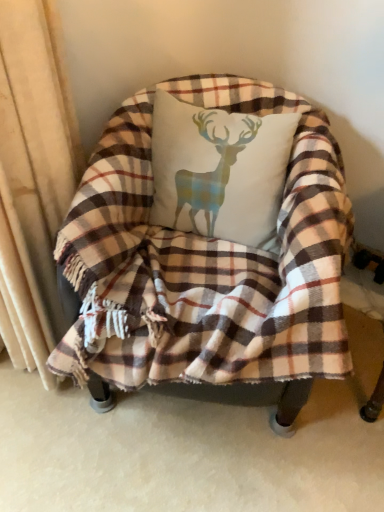
Question: Considering the positions of point (231, 200) and point (130, 360), is point (231, 200) closer or farther from the camera than point (130, 360)?

Choices:
 (A) closer
 (B) farther

Answer: (B)

Question: In the image, is white cotton cushion with deer print at center on the left side or the right side of plaid fabric chair at center?

Choices:
 (A) left
 (B) right

Answer: (B)

Question: From a real-world perspective, is white cotton cushion with deer print at center physically located above or below plaid fabric chair at center?

Choices:
 (A) above
 (B) below

Answer: (A)

Question: Looking at the image, does plaid fabric chair at center seem bigger or smaller compared to white cotton cushion with deer print at center?

Choices:
 (A) big
 (B) small

Answer: (A)

Question: From the image's perspective, is plaid fabric chair at center located above or below white cotton cushion with deer print at center?

Choices:
 (A) above
 (B) below

Answer: (B)

Question: Considering their positions, is plaid fabric chair at center located in front of or behind white cotton cushion with deer print at center?

Choices:
 (A) front
 (B) behind

Answer: (A)

Question: Based on their positions, is plaid fabric chair at center located to the left or right of white cotton cushion with deer print at center?

Choices:
 (A) left
 (B) right

Answer: (A)